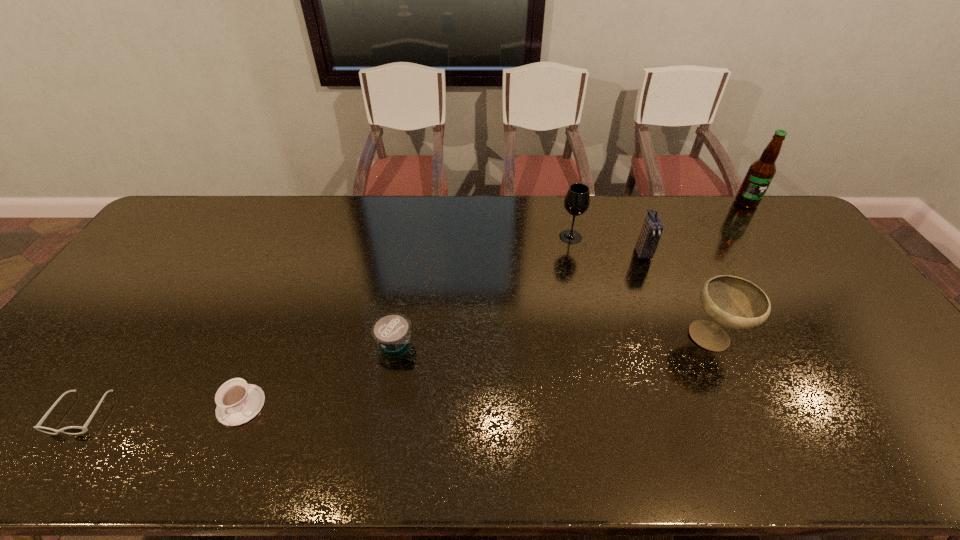
Where is `vacant space that's between the yogurt and the tallest object`? This screenshot has height=540, width=960. vacant space that's between the yogurt and the tallest object is located at coordinates (570, 272).

You are a GUI agent. You are given a task and a screenshot of the screen. Output one action in this format:
    pyautogui.click(x=<x>, y=<y>)
    Task: Click on the vacant space in between the sixth object from right to left and the shortest object
    
    Given the screenshot: What is the action you would take?
    pyautogui.click(x=161, y=409)

Where is `vacant area that lies between the teacup and the third object from left to right`? This screenshot has width=960, height=540. vacant area that lies between the teacup and the third object from left to right is located at coordinates (318, 374).

Find the location of `vacant area that lies between the yogurt and the chalice`. vacant area that lies between the yogurt and the chalice is located at coordinates (554, 340).

Where is `free area in between the fourth object from right to left and the chalice`? free area in between the fourth object from right to left and the chalice is located at coordinates (641, 287).

Locate an element on the screen. The height and width of the screenshot is (540, 960). vacant space that is in between the farthest object and the chalice is located at coordinates (730, 271).

Where is `the fifth closest object to the chalice`? This screenshot has width=960, height=540. the fifth closest object to the chalice is located at coordinates pyautogui.click(x=237, y=402).

Locate an element on the screen. The width and height of the screenshot is (960, 540). the third closest object to the clutch bag is located at coordinates (761, 172).

At what (x,y) coordinates should I click in order to perform the action: click on vacant area in the image that satisfies the following two spatial constraints: 1. with the zip open on the chalice; 2. on the left side of the clutch bag. Please return your answer as a coordinate pair (x, y). This screenshot has width=960, height=540. Looking at the image, I should click on (676, 338).